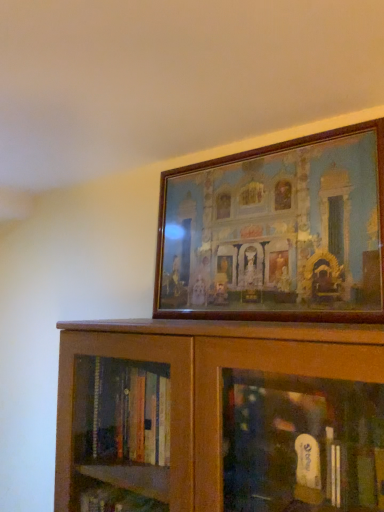
The image size is (384, 512). What do you see at coordinates (277, 232) in the screenshot? I see `wooden picture frame at upper center` at bounding box center [277, 232].

This screenshot has height=512, width=384. Find the location of `wooden picture frame at upper center`. wooden picture frame at upper center is located at coordinates (277, 232).

I want to click on wooden picture frame at upper center, so click(x=277, y=232).